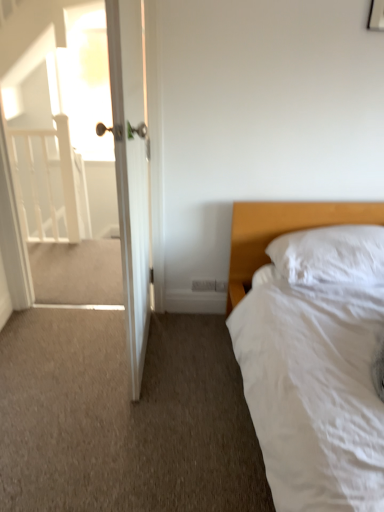
Question: Based on their sizes in the image, would you say white soft bed at right is bigger or smaller than white soft pillow at right?

Choices:
 (A) big
 (B) small

Answer: (A)

Question: From the image's perspective, is white soft bed at right located above or below white soft pillow at right?

Choices:
 (A) above
 (B) below

Answer: (B)

Question: Estimate the real-world distances between objects in this image. Which object is closer to the white wooden door at left?

Choices:
 (A) white soft bed at right
 (B) white glossy door at upper left
 (C) white soft pillow at right
 (D) white wooden balustrade at left

Answer: (A)

Question: Which of these objects is positioned closest to the white glossy door at upper left?

Choices:
 (A) white soft pillow at right
 (B) white wooden balustrade at left
 (C) white soft bed at right
 (D) white wooden door at left

Answer: (B)